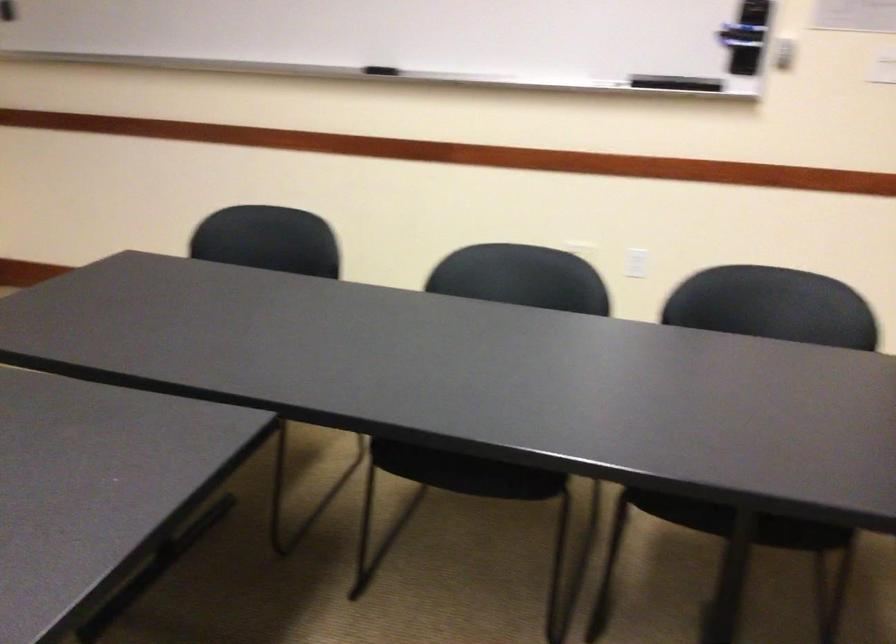
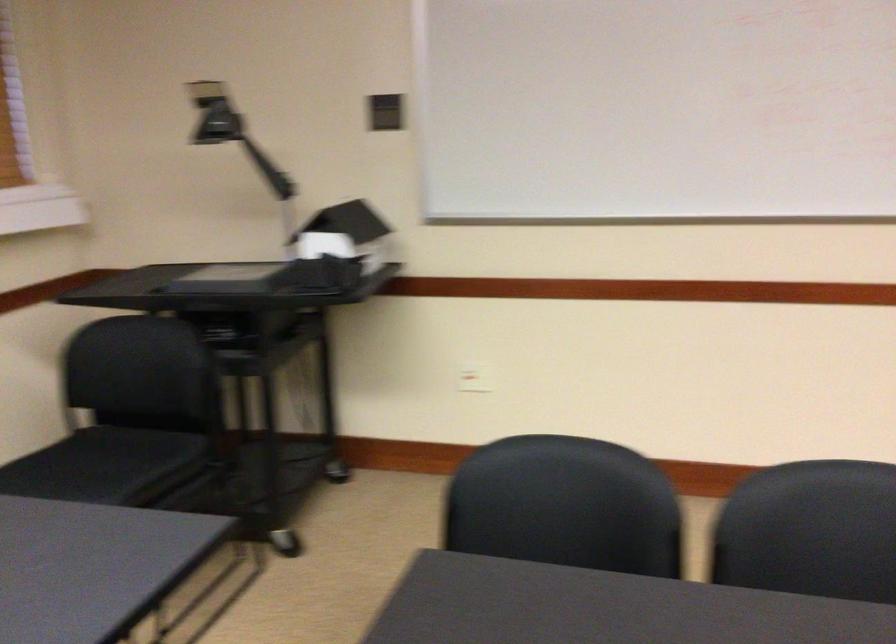
Question: Based on the continuous images, in which direction is the camera rotating? Reply with the corresponding letter.

Choices:
 (A) Left
 (B) Right
 (C) Up
 (D) Down

Answer: (A)